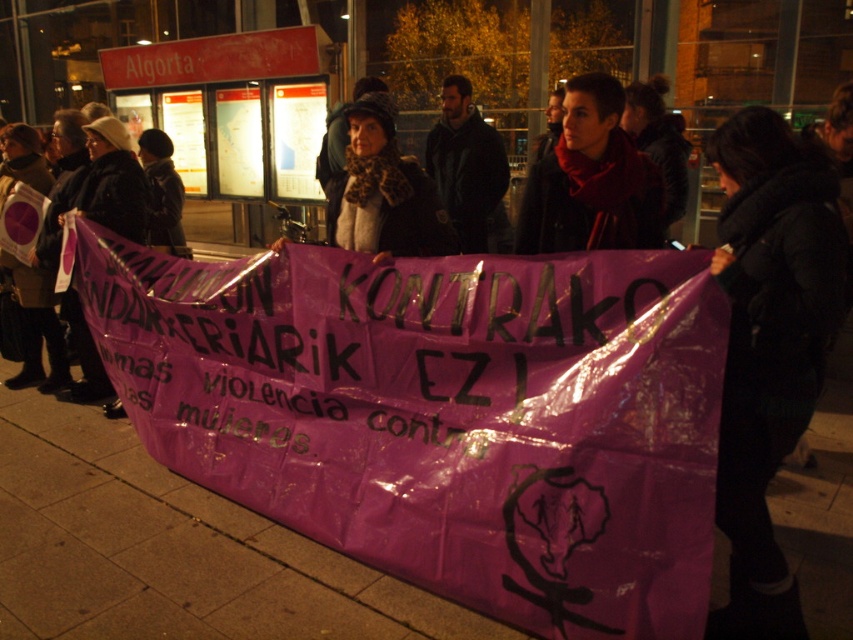
You are a photographer at the protest scene. You need to capture a photo that includes both the dark blue jacket at center and the black woolen hat at upper left. Which object should you adjust your camera angle to focus on first to ensure both fit in the frame?

The dark blue jacket at center is wider than the black woolen hat at upper left, so you should focus on the dark blue jacket at center first to ensure both objects fit in the frame.

You are a photographer trying to capture the protest scene. You notice a dark blue jacket at center and a black woolen hat at upper left. Which object would appear bigger in your photo?

The dark blue jacket at center would appear bigger in the photo since it has a larger size compared to the black woolen hat at upper left.